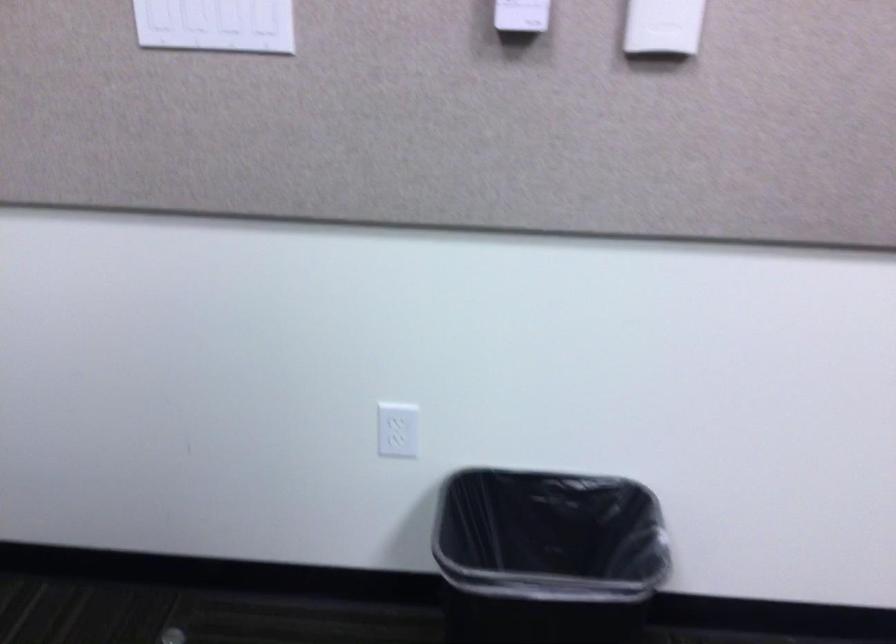
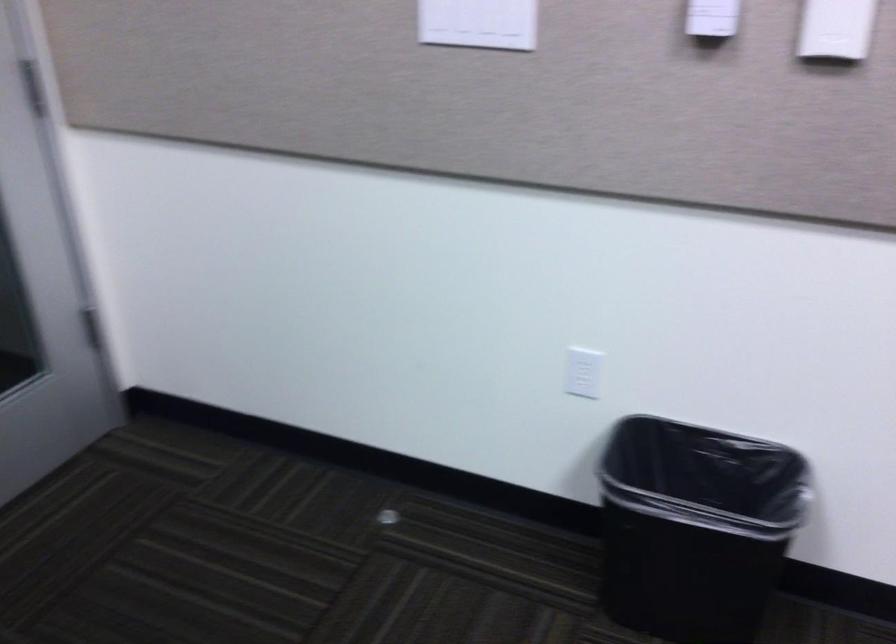
Which direction would the cameraman need to move to produce the second image?

The cameraman walked toward right, backward.